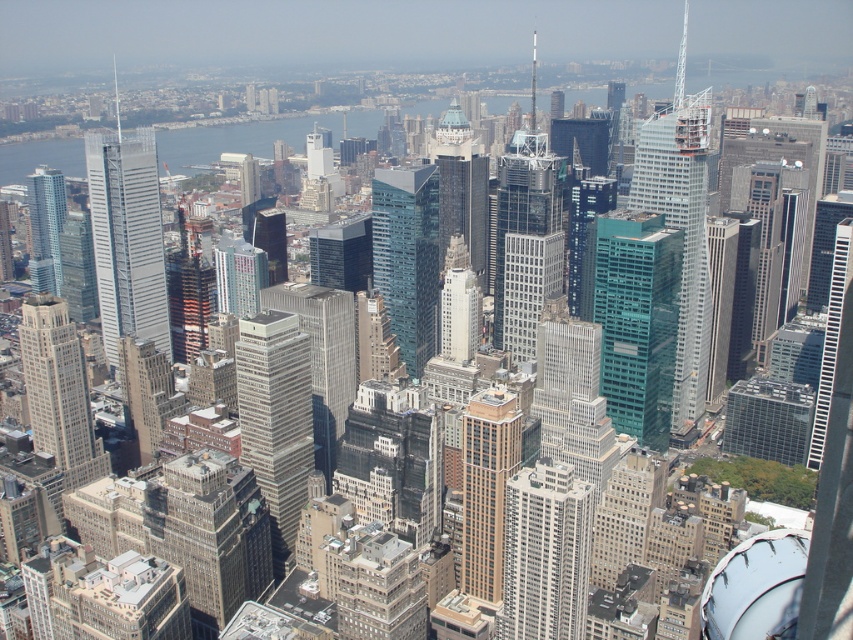
You are standing on a balcony overlooking the city and see the white glass building at center and the brown brick building at center. Which building is closer to you?

The white glass building at center is closer to you because it is positioned further to the viewer than the brown brick building at center.

Consider the image. You are an urban planner reviewing this city layout. You notice the glassy steel skyscraper at center and the shiny glass skyscraper at left. Which of these two buildings is located closer to the front of the city view?

The glassy steel skyscraper at center is positioned under the shiny glass skyscraper at left, meaning it is closer to the front of the city view since it appears beneath it in the visual hierarchy.